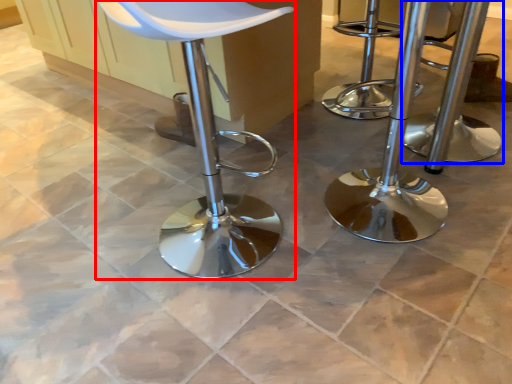
Question: Which of the following is the farthest to the observer, chair (highlighted by a red box) or stool (highlighted by a blue box)?

Choices:
 (A) chair
 (B) stool

Answer: (B)